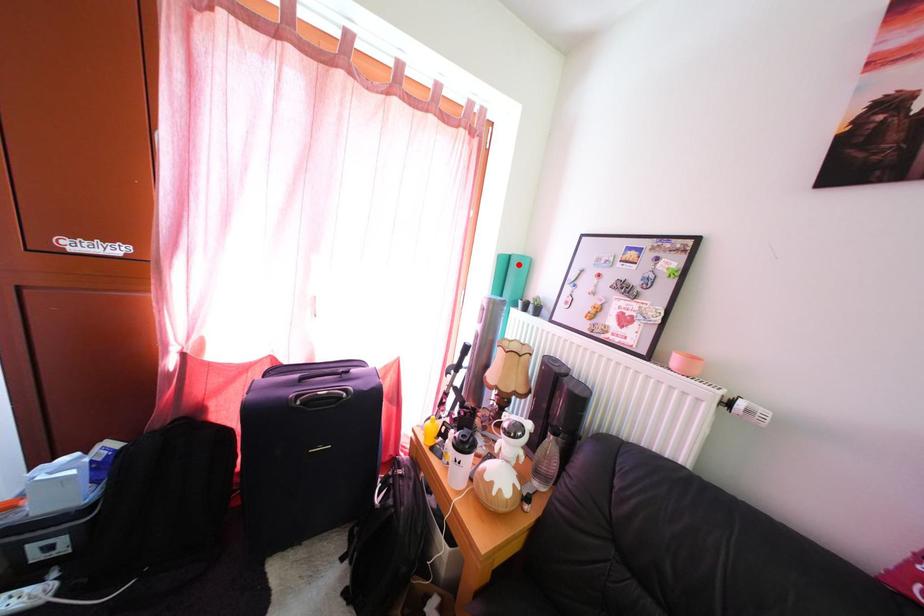
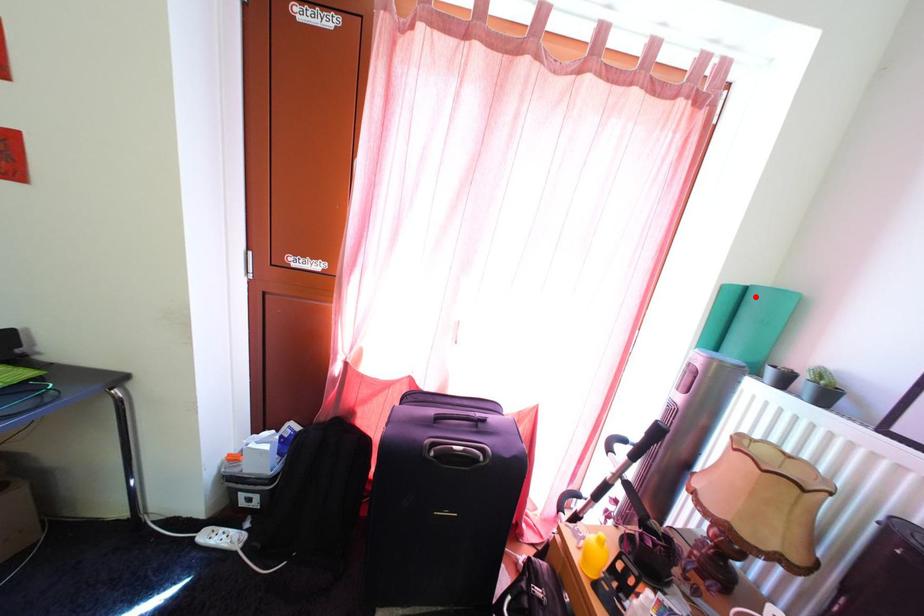
I am providing you with two images of the same scene from different viewpoints. A red point is marked on the first image and another point is marked on the second image. Does the point marked in image1 correspond to the same location as the one in image2?

Yes